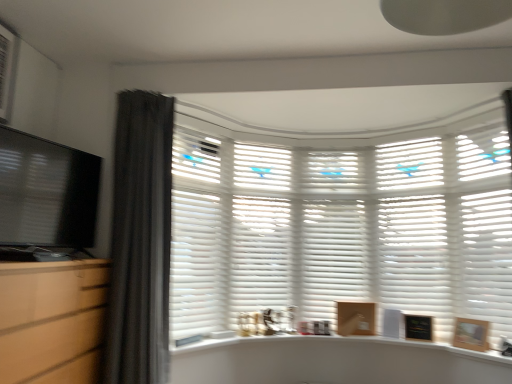
The height and width of the screenshot is (384, 512). Describe the element at coordinates (333, 344) in the screenshot. I see `white matte counter top at center` at that location.

Where is `white matte shutter at center, which is the third shutter in left-to-right order`? This screenshot has width=512, height=384. white matte shutter at center, which is the third shutter in left-to-right order is located at coordinates (329, 231).

Where is `white matte shutter at upper right, which ranks as the fourth shutter in left-to-right order`? The image size is (512, 384). white matte shutter at upper right, which ranks as the fourth shutter in left-to-right order is located at coordinates (413, 230).

Image resolution: width=512 pixels, height=384 pixels. Describe the element at coordinates (47, 192) in the screenshot. I see `matte black monitor at left` at that location.

How much space does white matte shutter at center, positioned as the second shutter in left-to-right order, occupy horizontally?

The width of white matte shutter at center, positioned as the second shutter in left-to-right order, is 11.29 inches.

Describe the element at coordinates (471, 334) in the screenshot. I see `wooden picture frame at lower right, the first picture frame viewed from the front` at that location.

The image size is (512, 384). I want to click on dark gray fabric curtain at left, so click(140, 240).

Which of these two, white matte shutter at center, the 3th shutter in the right-to-left sequence, or black matte picture frame at lower right, acting as the 2th picture frame starting from the right, is thinner?

Thinner between the two is black matte picture frame at lower right, acting as the 2th picture frame starting from the right.

Which is correct: white matte shutter at center, the 3th shutter in the right-to-left sequence, is inside black matte picture frame at lower right, acting as the 2th picture frame starting from the right, or outside of it?

white matte shutter at center, the 3th shutter in the right-to-left sequence, exists outside the volume of black matte picture frame at lower right, acting as the 2th picture frame starting from the right.

Is point (307, 315) closer or farther from the camera than point (420, 335)?

Point (307, 315) is farther from the camera than point (420, 335).

Can you tell me how much white plastic air conditioner at upper left and matte wood file cabinet at left differ in facing direction?

white plastic air conditioner at upper left and matte wood file cabinet at left are facing 0.513 degrees away from each other.

Which point is more forward, [7,91] or [3,349]?

Point [3,349]

Which object is further away from the camera taking this photo, white plastic air conditioner at upper left or matte wood file cabinet at left?

white plastic air conditioner at upper left.

From the image's perspective, is white plastic air conditioner at upper left located above or below matte wood file cabinet at left?

Clearly, from the image's perspective, white plastic air conditioner at upper left is above matte wood file cabinet at left.

Is white matte counter top at center touching white matte shutter at upper right, the second shutter positioned from the right?

No, white matte counter top at center is not in contact with white matte shutter at upper right, the second shutter positioned from the right.

In terms of height, does white matte counter top at center look taller or shorter compared to white matte shutter at upper right, which ranks as the fourth shutter in left-to-right order?

white matte counter top at center is shorter than white matte shutter at upper right, which ranks as the fourth shutter in left-to-right order.

Does white matte counter top at center turn towards white matte shutter at upper right, the second shutter positioned from the right?

No, white matte counter top at center is not turned towards white matte shutter at upper right, the second shutter positioned from the right.

Is white matte counter top at center spatially inside white matte shutter at upper right, the second shutter positioned from the right, or outside of it?

white matte counter top at center is spatially situated outside white matte shutter at upper right, the second shutter positioned from the right.

Considering the positions of objects white matte shutter at right, which is the first shutter in right-to-left order, and white matte shutter at center, which ranks as the 5th shutter in right-to-left order, in the image provided, who is more to the right, white matte shutter at right, which is the first shutter in right-to-left order, or white matte shutter at center, which ranks as the 5th shutter in right-to-left order,?

From the viewer's perspective, white matte shutter at right, which is the first shutter in right-to-left order, appears more on the right side.

Considering the sizes of objects white matte shutter at right, which is the first shutter in right-to-left order, and white matte shutter at center, which ranks as the 5th shutter in right-to-left order, in the image provided, who is thinner, white matte shutter at right, which is the first shutter in right-to-left order, or white matte shutter at center, which ranks as the 5th shutter in right-to-left order,?

white matte shutter at right, which is the first shutter in right-to-left order.

Can we say white matte shutter at right, the 5th shutter when ordered from left to right, lies outside white matte shutter at center, which ranks as the 5th shutter in right-to-left order?

Yes.

Is point (297, 220) positioned before point (442, 173)?

No, (297, 220) is behind (442, 173).

Who is bigger, white matte shutter at center, the 3th shutter in the right-to-left sequence, or white matte shutter at upper right, which ranks as the fourth shutter in left-to-right order?

white matte shutter at upper right, which ranks as the fourth shutter in left-to-right order.

Considering the sizes of white matte shutter at center, which is the third shutter in left-to-right order, and white matte shutter at upper right, which ranks as the fourth shutter in left-to-right order, in the image, is white matte shutter at center, which is the third shutter in left-to-right order, taller or shorter than white matte shutter at upper right, which ranks as the fourth shutter in left-to-right order,?

In the image, white matte shutter at center, which is the third shutter in left-to-right order, appears to be shorter than white matte shutter at upper right, which ranks as the fourth shutter in left-to-right order.

Considering the sizes of objects white matte shutter at center, which is the third shutter in left-to-right order, and white matte shutter at upper right, the second shutter positioned from the right, in the image provided, who is thinner, white matte shutter at center, which is the third shutter in left-to-right order, or white matte shutter at upper right, the second shutter positioned from the right,?

Thinner between the two is white matte shutter at upper right, the second shutter positioned from the right.

The width and height of the screenshot is (512, 384). In order to click on air conditioner in front of the white matte shutter at center, which ranks as the 5th shutter in right-to-left order in this screenshot , I will do `click(7, 69)`.

Can you confirm if white plastic air conditioner at upper left is taller than white matte shutter at center, which ranks as the 5th shutter in right-to-left order?

No, white plastic air conditioner at upper left is not taller than white matte shutter at center, which ranks as the 5th shutter in right-to-left order.

From a real-world perspective, which is physically above, white plastic air conditioner at upper left or white matte shutter at center, which ranks as the 5th shutter in right-to-left order?

From a 3D spatial view, white plastic air conditioner at upper left is above.

Considering the positions of points (9, 82) and (180, 267), is point (9, 82) farther from camera compared to point (180, 267)?

No, (9, 82) is in front of (180, 267).

Who is smaller, white matte shutter at right, the 5th shutter when ordered from left to right, or white plastic air conditioner at upper left?

With smaller size is white plastic air conditioner at upper left.

Is point (507, 328) closer to viewer compared to point (15, 65)?

That is False.

Does white matte shutter at right, which is the first shutter in right-to-left order, have a lesser width compared to white plastic air conditioner at upper left?

No, white matte shutter at right, which is the first shutter in right-to-left order, is not thinner than white plastic air conditioner at upper left.

In the scene shown: From a real-world perspective, who is located higher, white matte shutter at right, which is the first shutter in right-to-left order, or white plastic air conditioner at upper left?

white plastic air conditioner at upper left.

This screenshot has width=512, height=384. In order to click on the 1st picture frame in front of the white matte shutter at center, the 3th shutter in the right-to-left sequence in this screenshot , I will do `click(418, 327)`.

Where is `file cabinet that is under the white plastic air conditioner at upper left (from a real-world perspective)`? Image resolution: width=512 pixels, height=384 pixels. file cabinet that is under the white plastic air conditioner at upper left (from a real-world perspective) is located at coordinates (51, 320).

When comparing their distances from white matte shutter at center, which is the third shutter in left-to-right order, does black matte picture frame at lower right, marked as the 1th picture frame in a left-to-right arrangement, or white matte counter top at center seem further?

black matte picture frame at lower right, marked as the 1th picture frame in a left-to-right arrangement, is positioned further to the anchor white matte shutter at center, which is the third shutter in left-to-right order.

Looking at the image, which one is located further to dark gray fabric curtain at left, matte wood file cabinet at left or white matte shutter at center, positioned as the second shutter in left-to-right order?

Based on the image, white matte shutter at center, positioned as the second shutter in left-to-right order, appears to be further to dark gray fabric curtain at left.

Based on the photo, when comparing their distances from white matte shutter at upper right, the second shutter positioned from the right, does white matte counter top at center or white matte shutter at center, which ranks as the 5th shutter in right-to-left order, seem further?

white matte shutter at center, which ranks as the 5th shutter in right-to-left order, is positioned further to the anchor white matte shutter at upper right, the second shutter positioned from the right.

Looking at the image, which one is located closer to white matte shutter at upper right, which ranks as the fourth shutter in left-to-right order, dark gray fabric curtain at left or white matte shutter at right, the 5th shutter when ordered from left to right?

Based on the image, white matte shutter at right, the 5th shutter when ordered from left to right, appears to be nearer to white matte shutter at upper right, which ranks as the fourth shutter in left-to-right order.

Estimate the real-world distances between objects in this image. Which object is further from matte black monitor at left, white plastic air conditioner at upper left or white matte shutter at upper right, which ranks as the fourth shutter in left-to-right order?

white matte shutter at upper right, which ranks as the fourth shutter in left-to-right order, is positioned further to the anchor matte black monitor at left.

Considering their positions, is white matte shutter at center, which ranks as the fourth shutter in right-to-left order, positioned further to white matte shutter at right, the 5th shutter when ordered from left to right, than white matte shutter at center, which is the third shutter in left-to-right order?

white matte shutter at center, which ranks as the fourth shutter in right-to-left order, is positioned further to the anchor white matte shutter at right, the 5th shutter when ordered from left to right.

Looking at the image, which one is located closer to white matte counter top at center, dark gray fabric curtain at left or white matte shutter at upper right, which ranks as the fourth shutter in left-to-right order?

white matte shutter at upper right, which ranks as the fourth shutter in left-to-right order, is positioned closer to the anchor white matte counter top at center.

Looking at the image, which one is located closer to black matte picture frame at lower right, acting as the 1th picture frame starting from the back, white matte shutter at center, positioned as the second shutter in left-to-right order, or dark gray fabric curtain at left?

white matte shutter at center, positioned as the second shutter in left-to-right order, lies closer to black matte picture frame at lower right, acting as the 1th picture frame starting from the back, than the other object.

Identify the location of computer monitor situated between matte wood file cabinet at left and black matte picture frame at lower right, marked as the 1th picture frame in a left-to-right arrangement, from left to right. The height and width of the screenshot is (384, 512). (47, 192).

I want to click on file cabinet between white plastic air conditioner at upper left and white matte counter top at center in the horizontal direction, so click(x=51, y=320).

Image resolution: width=512 pixels, height=384 pixels. What are the coordinates of `counter top between dark gray fabric curtain at left and white matte shutter at right, which is the first shutter in right-to-left order, from left to right` in the screenshot? It's located at (333, 344).

Find the location of a particular element. picture frame situated between white plastic air conditioner at upper left and wooden picture frame at lower right, which ranks as the 1th picture frame in right-to-left order, from left to right is located at coordinates pyautogui.click(x=418, y=327).